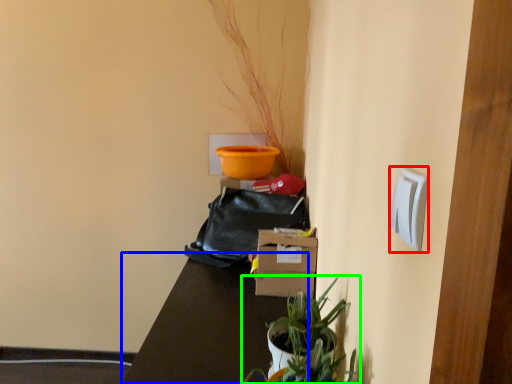
Question: Which object is the farthest from light switch (highlighted by a red box)? Choose among these: table (highlighted by a blue box) or houseplant (highlighted by a green box).

Choices:
 (A) table
 (B) houseplant

Answer: (A)